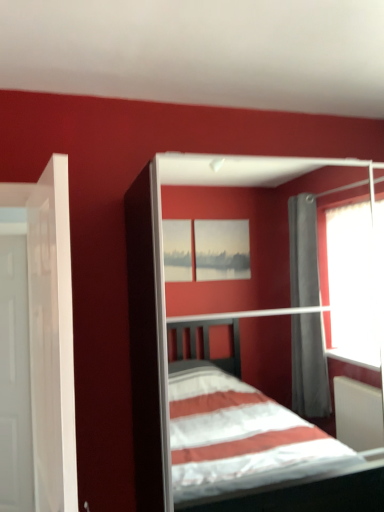
Question: From the image's perspective, does white glossy door at left, which is counted as the 1th door, starting from the front, appear higher than white matte bed at center?

Choices:
 (A) yes
 (B) no

Answer: (A)

Question: Can you confirm if white glossy door at left, placed as the 1th door when sorted from right to left, is positioned to the right of white matte bed at center?

Choices:
 (A) yes
 (B) no

Answer: (B)

Question: From a real-world perspective, is white glossy door at left, which is counted as the 1th door, starting from the front, over white matte bed at center?

Choices:
 (A) no
 (B) yes

Answer: (B)

Question: Can you confirm if white glossy door at left, which ranks as the 2th door in left-to-right order, is smaller than white matte bed at center?

Choices:
 (A) no
 (B) yes

Answer: (B)

Question: Is white glossy door at left, which is counted as the 1th door, starting from the front, facing away from white matte bed at center?

Choices:
 (A) no
 (B) yes

Answer: (B)

Question: Does white glossy door at left, positioned as the second door in back-to-front order, have a greater width compared to white matte bed at center?

Choices:
 (A) no
 (B) yes

Answer: (A)

Question: From the image's perspective, does white glossy door at left, marked as the second door in a front-to-back arrangement, appear lower than white glossy door at left, which ranks as the 2th door in left-to-right order?

Choices:
 (A) yes
 (B) no

Answer: (A)

Question: Considering the relative positions of white glossy door at left, acting as the 1th door starting from the left, and white glossy door at left, positioned as the second door in back-to-front order, in the image provided, is white glossy door at left, acting as the 1th door starting from the left, to the left of white glossy door at left, positioned as the second door in back-to-front order, from the viewer's perspective?

Choices:
 (A) yes
 (B) no

Answer: (A)

Question: Is white glossy door at left, positioned as the 2th door in right-to-left order, oriented away from white glossy door at left, which is counted as the 1th door, starting from the front?

Choices:
 (A) no
 (B) yes

Answer: (A)

Question: From a real-world perspective, is white glossy door at left, marked as the second door in a front-to-back arrangement, positioned under white glossy door at left, positioned as the second door in back-to-front order, based on gravity?

Choices:
 (A) no
 (B) yes

Answer: (B)

Question: Considering the relative sizes of white glossy door at left, acting as the 1th door starting from the left, and white glossy door at left, positioned as the second door in back-to-front order, in the image provided, is white glossy door at left, acting as the 1th door starting from the left, taller than white glossy door at left, positioned as the second door in back-to-front order,?

Choices:
 (A) no
 (B) yes

Answer: (B)

Question: Are white glossy door at left, the first door positioned from the back, and white glossy door at left, positioned as the second door in back-to-front order, far apart?

Choices:
 (A) no
 (B) yes

Answer: (B)

Question: Can you confirm if white matte bed at center is thinner than white glossy door at left, acting as the 1th door starting from the left?

Choices:
 (A) yes
 (B) no

Answer: (B)